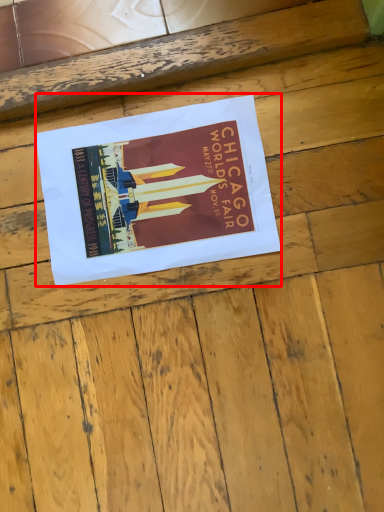
Question: In this image, where is poster (annotated by the red box) located relative to plywood?

Choices:
 (A) right
 (B) left

Answer: (B)